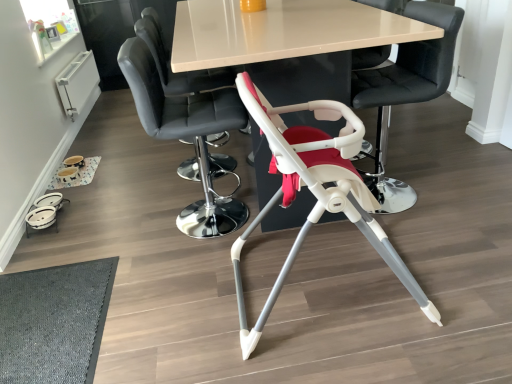
The image size is (512, 384). Identify the location of dark gray textured mat at lower left. (54, 322).

Describe the element at coordinates (54, 322) in the screenshot. I see `dark gray textured mat at lower left` at that location.

What is the approximate width of white plastic highchair at center, placed as the second chair when sorted from right to left?

It is 28.04 inches.

The image size is (512, 384). What do you see at coordinates (315, 191) in the screenshot?
I see `white plastic highchair at center, placed as the second chair when sorted from right to left` at bounding box center [315, 191].

The image size is (512, 384). What do you see at coordinates (409, 70) in the screenshot?
I see `white plastic highchair at center, acting as the fourth chair starting from the left` at bounding box center [409, 70].

From the picture: Measure the distance between point (x=428, y=21) and camera.

A distance of 5.91 feet exists between point (x=428, y=21) and camera.

The height and width of the screenshot is (384, 512). What do you see at coordinates (187, 135) in the screenshot?
I see `smooth black chair at center, which is the 3th chair in right-to-left order` at bounding box center [187, 135].

The width and height of the screenshot is (512, 384). What are the coordinates of `dark gray textured mat at lower left` in the screenshot? It's located at (54, 322).

Considering the sizes of objects smooth black chair at center, the second chair when ordered from left to right, and white glossy table at center in the image provided, who is wider, smooth black chair at center, the second chair when ordered from left to right, or white glossy table at center?

white glossy table at center is wider.

Is the surface of smooth black chair at center, the second chair when ordered from left to right, in direct contact with white glossy table at center?

No, smooth black chair at center, the second chair when ordered from left to right, is not next to white glossy table at center.

From a real-world perspective, who is located lower, smooth black chair at center, which is the 3th chair in right-to-left order, or white glossy table at center?

From a 3D spatial view, white glossy table at center is below.

Does smooth black chair at center, the second chair when ordered from left to right, have a greater width compared to dark gray textured mat at lower left?

Incorrect, the width of smooth black chair at center, the second chair when ordered from left to right, does not surpass that of dark gray textured mat at lower left.

From the picture: Is smooth black chair at center, which is the 3th chair in right-to-left order, located outside dark gray textured mat at lower left?

Yes, smooth black chair at center, which is the 3th chair in right-to-left order, is located beyond the bounds of dark gray textured mat at lower left.

Is smooth black chair at center, the second chair when ordered from left to right, turned away from dark gray textured mat at lower left?

That's not correct — smooth black chair at center, the second chair when ordered from left to right, is not looking away from dark gray textured mat at lower left.

From the image's perspective, is smooth black chair at center, which is the 3th chair in right-to-left order, positioned above or below white plastic highchair at center, marked as the first chair in a right-to-left arrangement?

Based on their image positions, smooth black chair at center, which is the 3th chair in right-to-left order, is located beneath white plastic highchair at center, marked as the first chair in a right-to-left arrangement.

Considering the sizes of objects smooth black chair at center, the second chair when ordered from left to right, and white plastic highchair at center, marked as the first chair in a right-to-left arrangement, in the image provided, who is taller, smooth black chair at center, the second chair when ordered from left to right, or white plastic highchair at center, marked as the first chair in a right-to-left arrangement,?

Standing taller between the two is white plastic highchair at center, marked as the first chair in a right-to-left arrangement.

Could you measure the distance between smooth black chair at center, the second chair when ordered from left to right, and white plastic highchair at center, acting as the fourth chair starting from the left?

smooth black chair at center, the second chair when ordered from left to right, is 30.15 inches from white plastic highchair at center, acting as the fourth chair starting from the left.

Is smooth black chair at center, which is the 3th chair in right-to-left order, facing towards white plastic highchair at center, marked as the first chair in a right-to-left arrangement?

Yes.

Considering the sizes of smooth leather chair at upper center, the fourth chair when ordered from right to left, and smooth black chair at center, the second chair when ordered from left to right, in the image, is smooth leather chair at upper center, the fourth chair when ordered from right to left, bigger or smaller than smooth black chair at center, the second chair when ordered from left to right,?

smooth leather chair at upper center, the fourth chair when ordered from right to left, is smaller than smooth black chair at center, the second chair when ordered from left to right.

Which is nearer, (136, 25) or (148, 63)?

The point (148, 63) is more forward.

Which of these two, smooth leather chair at upper center, the fourth chair when ordered from right to left, or smooth black chair at center, which is the 3th chair in right-to-left order, stands shorter?

smooth black chair at center, which is the 3th chair in right-to-left order.

From the image's perspective, which is below, smooth leather chair at upper center, the fourth chair when ordered from right to left, or smooth black chair at center, which is the 3th chair in right-to-left order?

From the image's view, smooth black chair at center, which is the 3th chair in right-to-left order, is below.

From a real-world perspective, does white plastic highchair at center, which appears as the 3th chair when viewed from the left, stand above dark gray textured mat at lower left?

Yes.

Is dark gray textured mat at lower left surrounded by white plastic highchair at center, placed as the second chair when sorted from right to left?

Actually, dark gray textured mat at lower left is outside white plastic highchair at center, placed as the second chair when sorted from right to left.

From the picture: From the image's perspective, which is above, white plastic highchair at center, placed as the second chair when sorted from right to left, or dark gray textured mat at lower left?

From the image's view, white plastic highchair at center, placed as the second chair when sorted from right to left, is above.

Based on the photo, is white plastic highchair at center, placed as the second chair when sorted from right to left, oriented towards white glossy table at center?

No, white plastic highchair at center, placed as the second chair when sorted from right to left, does not turn towards white glossy table at center.

Looking at the image, does white plastic highchair at center, placed as the second chair when sorted from right to left, seem bigger or smaller compared to white glossy table at center?

white plastic highchair at center, placed as the second chair when sorted from right to left, is smaller than white glossy table at center.

From a real-world perspective, is white plastic highchair at center, which appears as the 3th chair when viewed from the left, positioned above or below white glossy table at center?

In terms of real-world spatial position, white plastic highchair at center, which appears as the 3th chair when viewed from the left, is below white glossy table at center.

Considering the relative sizes of white plastic highchair at center, which appears as the 3th chair when viewed from the left, and white glossy table at center in the image provided, is white plastic highchair at center, which appears as the 3th chair when viewed from the left, taller than white glossy table at center?

No.

Can you confirm if white plastic highchair at center, marked as the first chair in a right-to-left arrangement, is wider than smooth leather chair at upper center, the fourth chair when ordered from right to left?

Indeed, white plastic highchair at center, marked as the first chair in a right-to-left arrangement, has a greater width compared to smooth leather chair at upper center, the fourth chair when ordered from right to left.

Could you tell me if white plastic highchair at center, marked as the first chair in a right-to-left arrangement, is facing smooth leather chair at upper center, the fourth chair when ordered from right to left?

No.

What are the coordinates of `chair above the white plastic highchair at center, marked as the first chair in a right-to-left arrangement (from the image's perspective)` in the screenshot? It's located at (168, 62).

Where is `table above the smooth black chair at center, which is the 3th chair in right-to-left order (from the image's perspective)`? The image size is (512, 384). table above the smooth black chair at center, which is the 3th chair in right-to-left order (from the image's perspective) is located at coordinates (282, 31).

The width and height of the screenshot is (512, 384). What are the coordinates of `mat that is below the smooth black chair at center, the second chair when ordered from left to right (from the image's perspective)` in the screenshot? It's located at (54, 322).

Which object lies further to the anchor point smooth leather chair at upper center, the fourth chair when ordered from right to left, white plastic highchair at center, marked as the first chair in a right-to-left arrangement, or white glossy table at center?

white plastic highchair at center, marked as the first chair in a right-to-left arrangement, is positioned further to the anchor smooth leather chair at upper center, the fourth chair when ordered from right to left.

Looking at the image, which one is located further to white plastic highchair at center, which appears as the 3th chair when viewed from the left, dark gray textured mat at lower left or smooth leather chair at upper center, which is the first chair in left-to-right order?

smooth leather chair at upper center, which is the first chair in left-to-right order, lies further to white plastic highchair at center, which appears as the 3th chair when viewed from the left, than the other object.

When comparing their distances from smooth leather chair at upper center, which is the first chair in left-to-right order, does dark gray textured mat at lower left or white plastic highchair at center, acting as the fourth chair starting from the left, seem further?

Based on the image, dark gray textured mat at lower left appears to be further to smooth leather chair at upper center, which is the first chair in left-to-right order.

When comparing their distances from smooth leather chair at upper center, which is the first chair in left-to-right order, does dark gray textured mat at lower left or smooth black chair at center, which is the 3th chair in right-to-left order, seem further?

dark gray textured mat at lower left is positioned further to the anchor smooth leather chair at upper center, which is the first chair in left-to-right order.

From the image, which object appears to be farther from white plastic highchair at center, marked as the first chair in a right-to-left arrangement, white plastic highchair at center, which appears as the 3th chair when viewed from the left, or smooth black chair at center, which is the 3th chair in right-to-left order?

smooth black chair at center, which is the 3th chair in right-to-left order, lies further to white plastic highchair at center, marked as the first chair in a right-to-left arrangement, than the other object.

Based on their spatial positions, is white plastic highchair at center, which appears as the 3th chair when viewed from the left, or dark gray textured mat at lower left closer to smooth leather chair at upper center, the fourth chair when ordered from right to left?

Based on the image, white plastic highchair at center, which appears as the 3th chair when viewed from the left, appears to be nearer to smooth leather chair at upper center, the fourth chair when ordered from right to left.

When comparing their distances from white plastic highchair at center, placed as the second chair when sorted from right to left, does smooth black chair at center, which is the 3th chair in right-to-left order, or smooth leather chair at upper center, the fourth chair when ordered from right to left, seem closer?

smooth black chair at center, which is the 3th chair in right-to-left order, lies closer to white plastic highchair at center, placed as the second chair when sorted from right to left, than the other object.

Based on their spatial positions, is dark gray textured mat at lower left or smooth leather chair at upper center, which is the first chair in left-to-right order, further from white plastic highchair at center, acting as the fourth chair starting from the left?

Among the two, dark gray textured mat at lower left is located further to white plastic highchair at center, acting as the fourth chair starting from the left.

Find the location of a particular element. The image size is (512, 384). table between dark gray textured mat at lower left and white plastic highchair at center, which appears as the 3th chair when viewed from the left is located at coordinates (282, 31).

I want to click on table located between smooth black chair at center, which is the 3th chair in right-to-left order, and white plastic highchair at center, acting as the fourth chair starting from the left, in the left-right direction, so click(282, 31).

Find the location of a particular element. This screenshot has height=384, width=512. table between white plastic highchair at center, which appears as the 3th chair when viewed from the left, and smooth leather chair at upper center, which is the first chair in left-to-right order, along the z-axis is located at coordinates (282, 31).

Locate an element on the screen. table situated between dark gray textured mat at lower left and white plastic highchair at center, marked as the first chair in a right-to-left arrangement, from left to right is located at coordinates (282, 31).